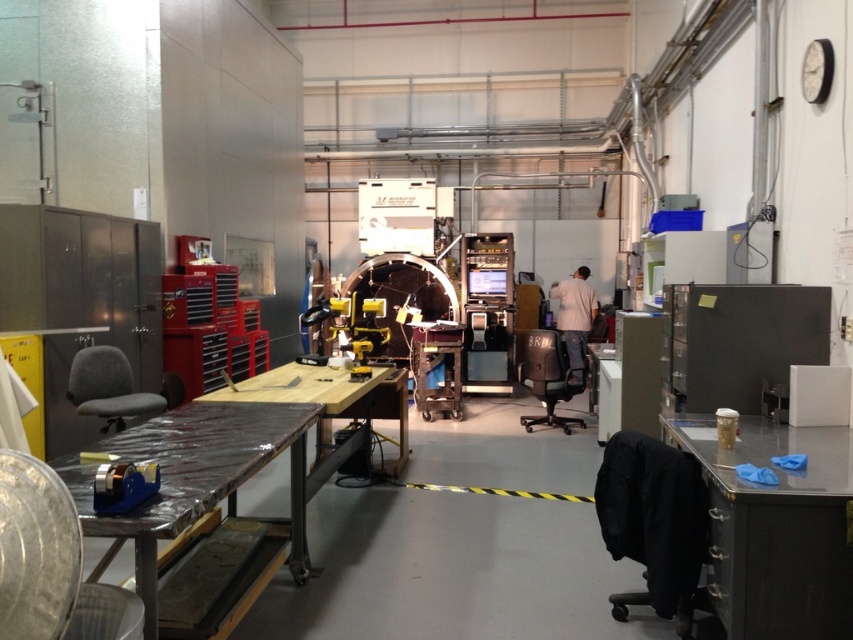
Question: Does metallic/plastic workbench at lower left appear over light beige shirt at center?

Choices:
 (A) no
 (B) yes

Answer: (A)

Question: Which point appears farthest from the camera in this image?

Choices:
 (A) (831, 556)
 (B) (576, 324)

Answer: (B)

Question: Considering the relative positions of gray matte workbench at lower right and light beige shirt at center in the image provided, where is gray matte workbench at lower right located with respect to light beige shirt at center?

Choices:
 (A) above
 (B) below

Answer: (B)

Question: Can you confirm if metallic/plastic workbench at lower left is positioned below light beige shirt at center?

Choices:
 (A) yes
 (B) no

Answer: (A)

Question: Among these objects, which one is nearest to the camera?

Choices:
 (A) metallic/plastic workbench at lower left
 (B) light beige shirt at center

Answer: (A)

Question: Which point is farther to the camera?

Choices:
 (A) metallic/plastic workbench at lower left
 (B) light beige shirt at center

Answer: (B)